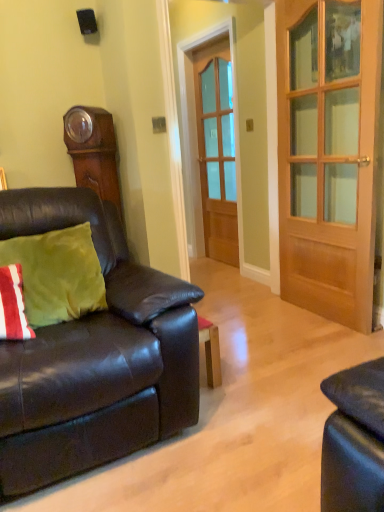
Question: Can you confirm if matte black couch at left is thinner than black matte speaker at upper center?

Choices:
 (A) yes
 (B) no

Answer: (B)

Question: Is matte black couch at left closer to the viewer compared to black matte speaker at upper center?

Choices:
 (A) no
 (B) yes

Answer: (B)

Question: Could you tell me if matte black couch at left is turned towards black matte speaker at upper center?

Choices:
 (A) no
 (B) yes

Answer: (A)

Question: Does matte black couch at left have a lesser height compared to black matte speaker at upper center?

Choices:
 (A) no
 (B) yes

Answer: (A)

Question: Is matte black couch at left to the left of black matte speaker at upper center from the viewer's perspective?

Choices:
 (A) no
 (B) yes

Answer: (A)

Question: Is wooden door at center, which is the first door from front to back, inside the boundaries of matte black couch at left, or outside?

Choices:
 (A) inside
 (B) outside

Answer: (B)

Question: Considering the positions of wooden door at center, which is the first door from front to back, and matte black couch at left in the image, is wooden door at center, which is the first door from front to back, taller or shorter than matte black couch at left?

Choices:
 (A) tall
 (B) short

Answer: (A)

Question: Considering their positions, is wooden door at center, which is counted as the 2th door, starting from the left, located in front of or behind matte black couch at left?

Choices:
 (A) front
 (B) behind

Answer: (B)

Question: Does point (339, 202) appear closer or farther from the camera than point (117, 330)?

Choices:
 (A) farther
 (B) closer

Answer: (A)

Question: From a real-world perspective, is wooden door at center, the 1th door viewed from the right, positioned above or below green velvet pillow at left?

Choices:
 (A) below
 (B) above

Answer: (B)

Question: Is wooden door at center, the 2th door from the back, bigger or smaller than green velvet pillow at left?

Choices:
 (A) big
 (B) small

Answer: (A)

Question: Is wooden door at center, which is counted as the 2th door, starting from the left, taller or shorter than green velvet pillow at left?

Choices:
 (A) short
 (B) tall

Answer: (B)

Question: Would you say wooden door at center, which is counted as the 2th door, starting from the left, is to the left or to the right of green velvet pillow at left in the picture?

Choices:
 (A) right
 (B) left

Answer: (A)

Question: Would you say black matte speaker at upper center is inside or outside matte black couch at left?

Choices:
 (A) inside
 (B) outside

Answer: (B)

Question: From the image's perspective, is black matte speaker at upper center located above or below matte black couch at left?

Choices:
 (A) above
 (B) below

Answer: (A)